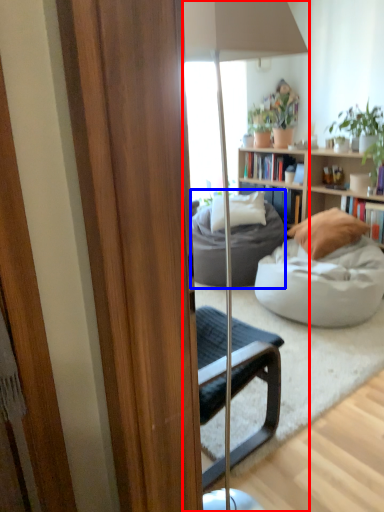
Question: Which object is closer to the camera taking this photo, lamp (highlighted by a red box) or studio couch (highlighted by a blue box)?

Choices:
 (A) lamp
 (B) studio couch

Answer: (A)